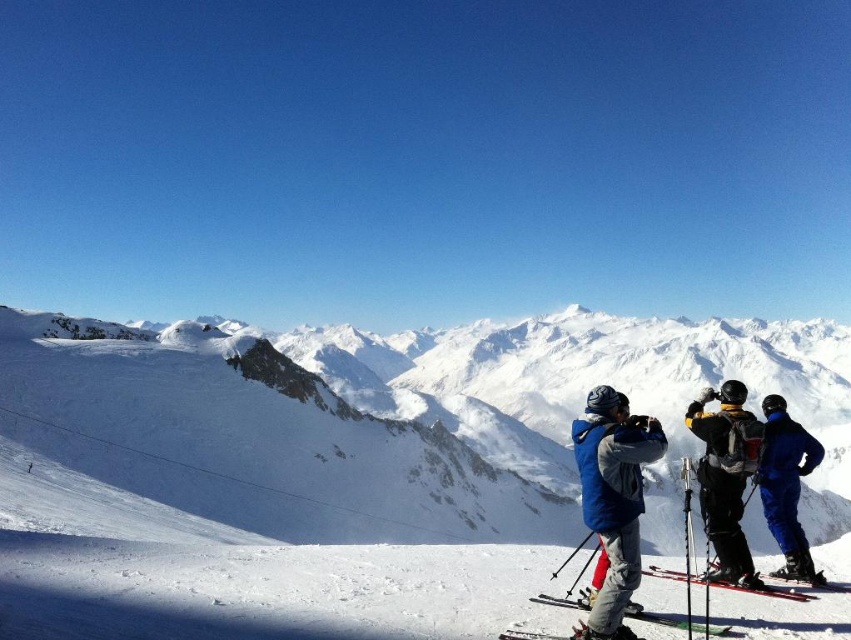
Between point (810, 449) and point (630, 612), which one is positioned behind?

The point (810, 449) is behind.

I want to click on blue ski suit at right, so click(786, 486).

Locate an element on the screen. blue ski suit at right is located at coordinates (786, 486).

Does point (797, 461) come behind point (694, 577)?

No, it is in front of (694, 577).

Image resolution: width=851 pixels, height=640 pixels. Find the location of `blue ski suit at right`. blue ski suit at right is located at coordinates (786, 486).

Is white snow-covered mountain at center taller than black matte ski suit at center right?

Yes, white snow-covered mountain at center is taller than black matte ski suit at center right.

Can you confirm if white snow-covered mountain at center is positioned below black matte ski suit at center right?

Yes.

Measure the distance between white snow-covered mountain at center and camera.

white snow-covered mountain at center and camera are 58.26 meters apart.

Where is `white snow-covered mountain at center`? Image resolution: width=851 pixels, height=640 pixels. white snow-covered mountain at center is located at coordinates (355, 424).